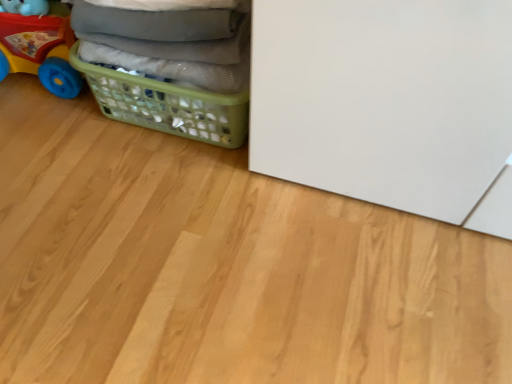
Find the location of a particular element. green plastic laundry basket at lower left is located at coordinates (167, 105).

What do you see at coordinates (167, 105) in the screenshot? The image size is (512, 384). I see `green plastic laundry basket at lower left` at bounding box center [167, 105].

Looking at this image, what is the approximate width of green plastic laundry basket at lower left?

It is 40.99 centimeters.

The height and width of the screenshot is (384, 512). I want to click on plastic toy car at left, so click(38, 45).

Measure the distance between plastic toy car at left and camera.

The distance of plastic toy car at left from camera is 1.16 meters.

This screenshot has width=512, height=384. What do you see at coordinates (38, 45) in the screenshot? I see `plastic toy car at left` at bounding box center [38, 45].

At what (x,y) coordinates should I click in order to perform the action: click on green plastic laundry basket at lower left. Please return your answer as a coordinate pair (x, y). This screenshot has height=384, width=512. Looking at the image, I should click on pos(167,105).

Would you say plastic toy car at left is to the left or to the right of green plastic laundry basket at lower left in the picture?

plastic toy car at left is to the left of green plastic laundry basket at lower left.

Is plastic toy car at left positioned behind green plastic laundry basket at lower left?

Yes, plastic toy car at left is further from the viewer.

Is point (72, 85) more distant than point (217, 94)?

Yes, point (72, 85) is behind point (217, 94).

From the image's perspective, is plastic toy car at left located beneath green plastic laundry basket at lower left?

No, from the image's perspective, plastic toy car at left is not beneath green plastic laundry basket at lower left.

From a real-world perspective, which object rests below the other?

green plastic laundry basket at lower left.

Is plastic toy car at left thinner than green plastic laundry basket at lower left?

Correct, the width of plastic toy car at left is less than that of green plastic laundry basket at lower left.

Between plastic toy car at left and green plastic laundry basket at lower left, which one has less height?

green plastic laundry basket at lower left.

Considering the sizes of objects plastic toy car at left and green plastic laundry basket at lower left in the image provided, who is bigger, plastic toy car at left or green plastic laundry basket at lower left?

With larger size is green plastic laundry basket at lower left.

Is green plastic laundry basket at lower left completely or partially inside plastic toy car at left?

No, plastic toy car at left does not contain green plastic laundry basket at lower left.

Is plastic toy car at left far away from green plastic laundry basket at lower left?

No, plastic toy car at left is in close proximity to green plastic laundry basket at lower left.

Could you tell me if plastic toy car at left is turned towards green plastic laundry basket at lower left?

No, plastic toy car at left does not turn towards green plastic laundry basket at lower left.

Can you tell me how much plastic toy car at left and green plastic laundry basket at lower left differ in facing direction?

They differ by 0.000167 degrees in their facing directions.

Identify the location of basket to the right of plastic toy car at left. The width and height of the screenshot is (512, 384). (167, 105).

Between green plastic laundry basket at lower left and plastic toy car at left, which one appears on the left side from the viewer's perspective?

From the viewer's perspective, plastic toy car at left appears more on the left side.

Consider the image. Considering the positions of objects green plastic laundry basket at lower left and plastic toy car at left in the image provided, who is in front, green plastic laundry basket at lower left or plastic toy car at left?

green plastic laundry basket at lower left is in front.

Is point (169, 88) positioned after point (45, 71)?

No, it is in front of (45, 71).

From the image's perspective, is green plastic laundry basket at lower left on top of plastic toy car at left?

No.

From a real-world perspective, is green plastic laundry basket at lower left located beneath plastic toy car at left?

Yes, from a real-world perspective, green plastic laundry basket at lower left is below plastic toy car at left.

Considering the relative sizes of green plastic laundry basket at lower left and plastic toy car at left in the image provided, is green plastic laundry basket at lower left thinner than plastic toy car at left?

In fact, green plastic laundry basket at lower left might be wider than plastic toy car at left.

Can you confirm if green plastic laundry basket at lower left is shorter than plastic toy car at left?

Indeed, green plastic laundry basket at lower left has a lesser height compared to plastic toy car at left.

Considering the relative sizes of green plastic laundry basket at lower left and plastic toy car at left in the image provided, is green plastic laundry basket at lower left smaller than plastic toy car at left?

Incorrect, green plastic laundry basket at lower left is not smaller in size than plastic toy car at left.

Could plastic toy car at left be considered to be inside green plastic laundry basket at lower left?

No.

Is green plastic laundry basket at lower left not near plastic toy car at left?

No, green plastic laundry basket at lower left is not far from plastic toy car at left.

Is plastic toy car at left at the back of green plastic laundry basket at lower left?

That's not correct — green plastic laundry basket at lower left is not looking away from plastic toy car at left.

Can you tell me how much green plastic laundry basket at lower left and plastic toy car at left differ in facing direction?

The angle between the facing direction of green plastic laundry basket at lower left and the facing direction of plastic toy car at left is 0.000167 degrees.

How much distance is there between green plastic laundry basket at lower left and plastic toy car at left?

They are 11.70 inches apart.

At what (x,y) coordinates should I click in order to perform the action: click on toy behind the green plastic laundry basket at lower left. Please return your answer as a coordinate pair (x, y). The image size is (512, 384). Looking at the image, I should click on (38, 45).

Locate an element on the screen. toy located behind the green plastic laundry basket at lower left is located at coordinates (38, 45).

Where is `toy lying above the green plastic laundry basket at lower left (from the image's perspective)`? Image resolution: width=512 pixels, height=384 pixels. toy lying above the green plastic laundry basket at lower left (from the image's perspective) is located at coordinates (38, 45).